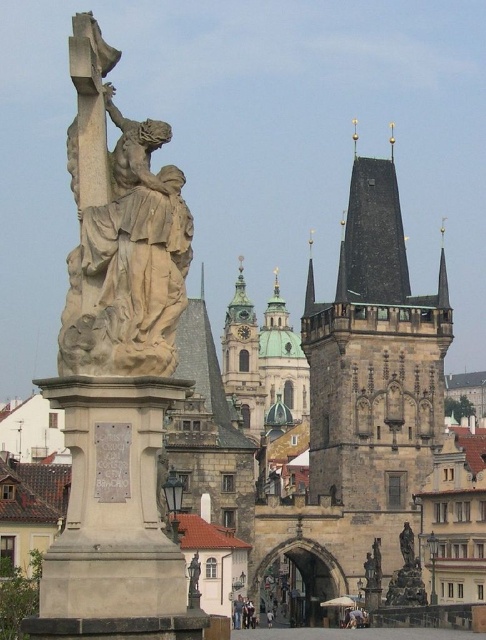
You are a tourist standing on the Charles Bridge and want to take a photo of both the polished stone tower at center right and the polished bronze statue at center. Based on their positions, which object should you position closer to the left side of your camera frame to include both in the shot?

You should position the polished stone tower at center right closer to the left side of your camera frame because it is already to the left of the polished bronze statue at center, allowing both to fit within the shot.

You are a tourist standing on the Charles Bridge in Prague. You see the polished stone tower at center right and the beige stone sculpture at center. Which one is positioned to the right side of the other?

The polished stone tower at center right is to the right of the beige stone sculpture at center.

You are a tourist standing on Charles Bridge in Prague. You see the polished bronze statue at center and the polished stone tower at center right. Which object is positioned farther away from you?

The polished bronze statue at center is farther away because it is located behind the polished stone tower at center right.